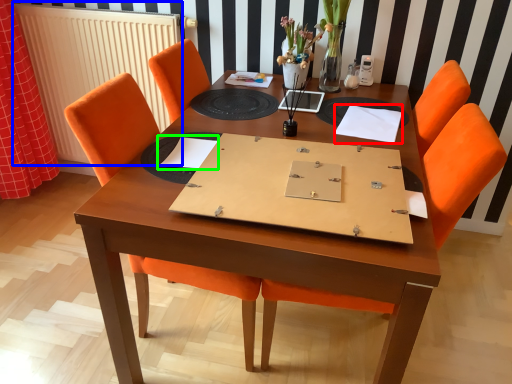
Question: Which object is positioned farthest from notebook (highlighted by a red box)? Select from radiator (highlighted by a blue box) and notebook (highlighted by a green box).

Choices:
 (A) radiator
 (B) notebook

Answer: (A)